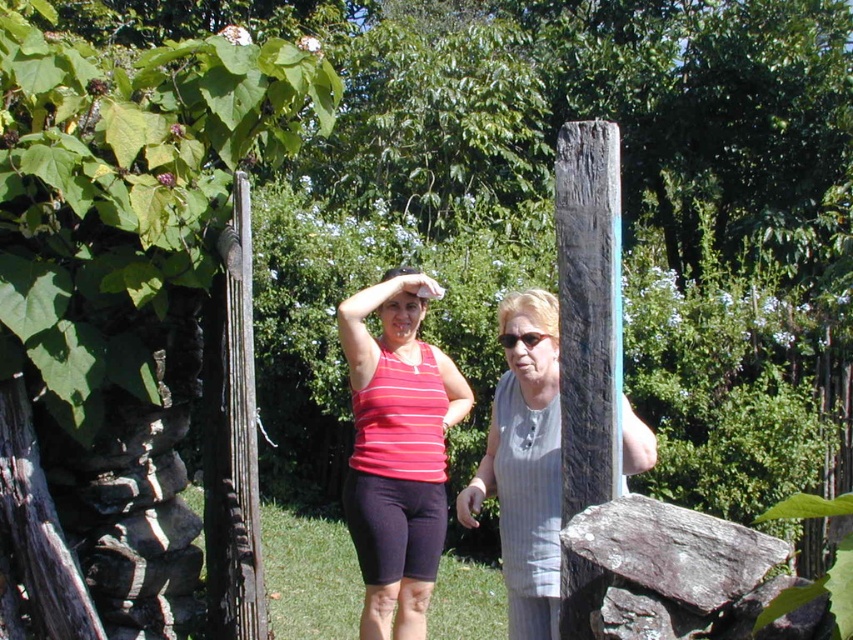
You are a photographer trying to capture a candid shot of the two people in the garden. You notice the weathered wood post at left and the matte black sunglasses at center. Which object is located to the left of the other?

The weathered wood post at left is positioned on the left side of matte black sunglasses at center.

You are designing a sign that needs to fit between the weathered wood post at left and the matte black sunglasses at center. The sign must be narrower than both objects. Can you create a sign that is 10 cm wide?

The weathered wood post at left is wider than the matte black sunglasses at center. Since the sign must be narrower than both, it needs to be less than the width of the sunglasses. If the sunglasses are narrower than 10 cm, then a 10 cm sign would not fit. However, without knowing the exact width of the sunglasses, we cannot confirm. Wait, but according to the Objects Description, the post is wider than the sunglasses. So the maximum allowable width for the sign is the sunglasses width. If the sunglasses at

You are a photographer trying to capture a photo of the weathered wood post at left and the matte black sunglasses at center. Based on their positions, which object is closer to the camera?

The matte black sunglasses at center is closer to the camera because the weathered wood post at left is positioned under it, indicating it is behind the sunglasses.